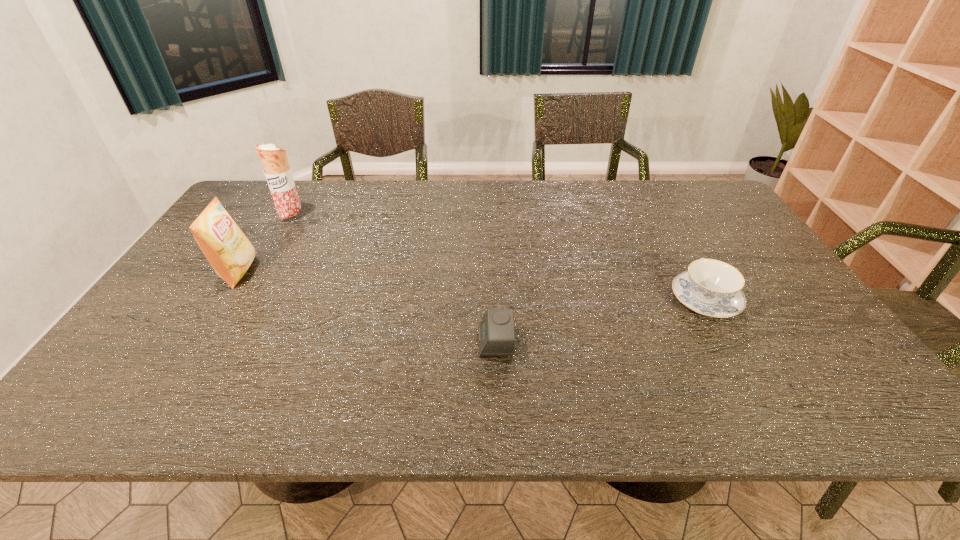
Image resolution: width=960 pixels, height=540 pixels. I want to click on vacant space located 0.220m with the handle on the side of the rightmost object, so click(667, 231).

The height and width of the screenshot is (540, 960). I want to click on vacant space located 0.390m with the handle on the side of the rightmost object, so click(x=651, y=202).

I want to click on vacant space located on the front-facing side of the second object from right to left, so click(416, 341).

At what (x,y) coordinates should I click in order to perform the action: click on vacant space located on the front-facing side of the second object from right to left. Please return your answer as a coordinate pair (x, y). This screenshot has width=960, height=540. Looking at the image, I should click on (326, 341).

The height and width of the screenshot is (540, 960). Find the location of `vacant position located 0.120m on the front-facing side of the second object from right to left`. vacant position located 0.120m on the front-facing side of the second object from right to left is located at coordinates (428, 341).

Identify the location of object present at the far edge. The image size is (960, 540). (277, 171).

The height and width of the screenshot is (540, 960). Find the location of `object located at the left edge`. object located at the left edge is located at coordinates (230, 253).

This screenshot has width=960, height=540. In order to click on object located at the right edge in this screenshot , I will do coord(710,287).

In the image, there is a desktop. Where is `free space at the far edge`? The height and width of the screenshot is (540, 960). free space at the far edge is located at coordinates (301, 205).

Identify the location of vacant region at the near edge of the desktop. The image size is (960, 540). (385, 391).